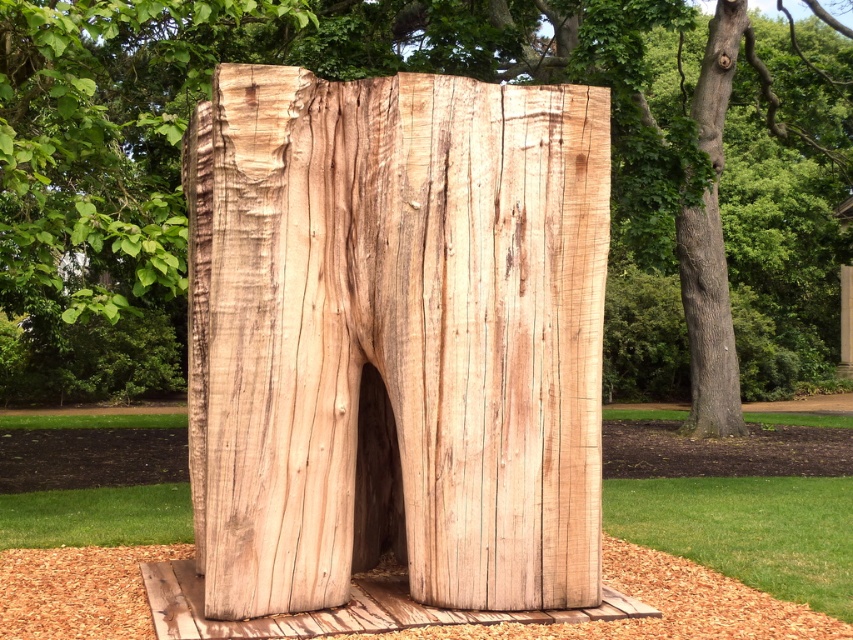
Question: Which of the following is the closest to the observer?

Choices:
 (A) natural wood sculpture at center
 (B) natural wood tree trunk at right

Answer: (A)

Question: Among these objects, which one is nearest to the camera?

Choices:
 (A) natural wood sculpture at center
 (B) natural wood tree trunk at right

Answer: (A)

Question: Where is natural wood sculpture at center located in relation to natural wood tree trunk at right in the image?

Choices:
 (A) above
 (B) below

Answer: (B)

Question: Is natural wood tree trunk at center smaller than natural wood tree trunk at right?

Choices:
 (A) yes
 (B) no

Answer: (B)

Question: Which object is the farthest from the natural wood tree trunk at center?

Choices:
 (A) natural wood tree trunk at right
 (B) natural wood sculpture at center

Answer: (A)

Question: From the image, what is the correct spatial relationship of natural wood tree trunk at center in relation to natural wood tree trunk at right?

Choices:
 (A) left
 (B) right

Answer: (A)